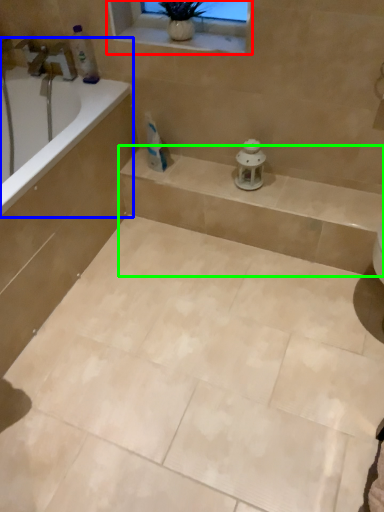
Question: Which object is positioned closest to window frame (highlighted by a red box)? Select from bathtub (highlighted by a blue box) and balustrade (highlighted by a green box).

Choices:
 (A) bathtub
 (B) balustrade

Answer: (A)